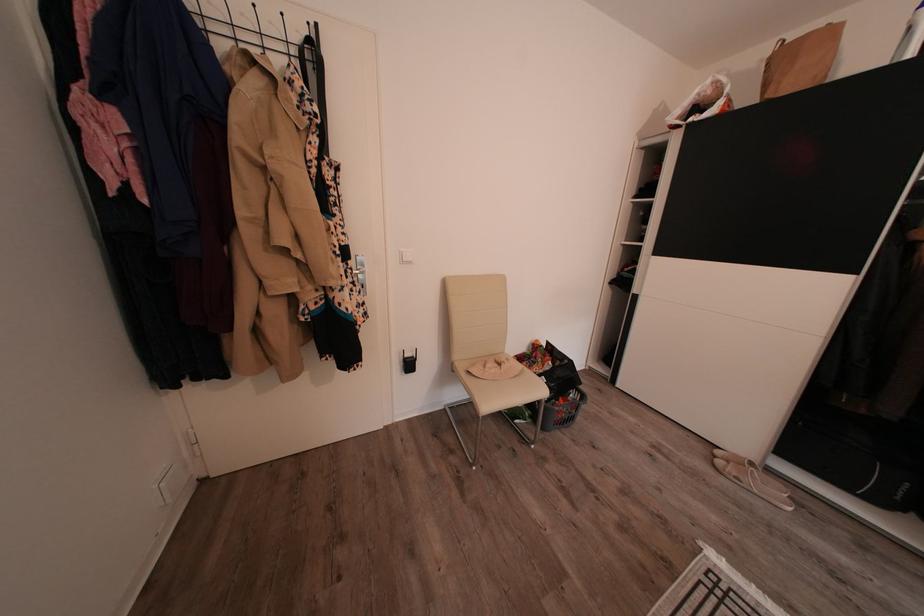
Find where to push the white light switch. Please return your answer as a coordinate pair (x, y).

(406, 256)